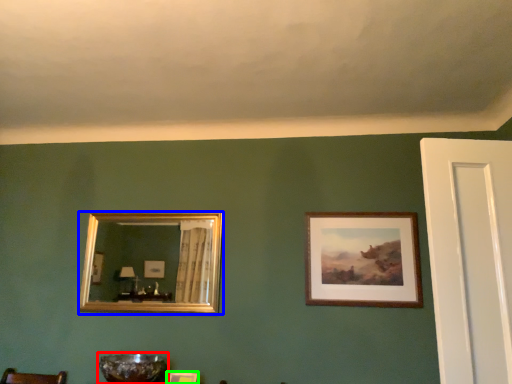
Question: Which object is positioned farthest from glass bowl (highlighted by a red box)? Select from picture frame (highlighted by a blue box) and picture frame (highlighted by a green box).

Choices:
 (A) picture frame
 (B) picture frame

Answer: (A)